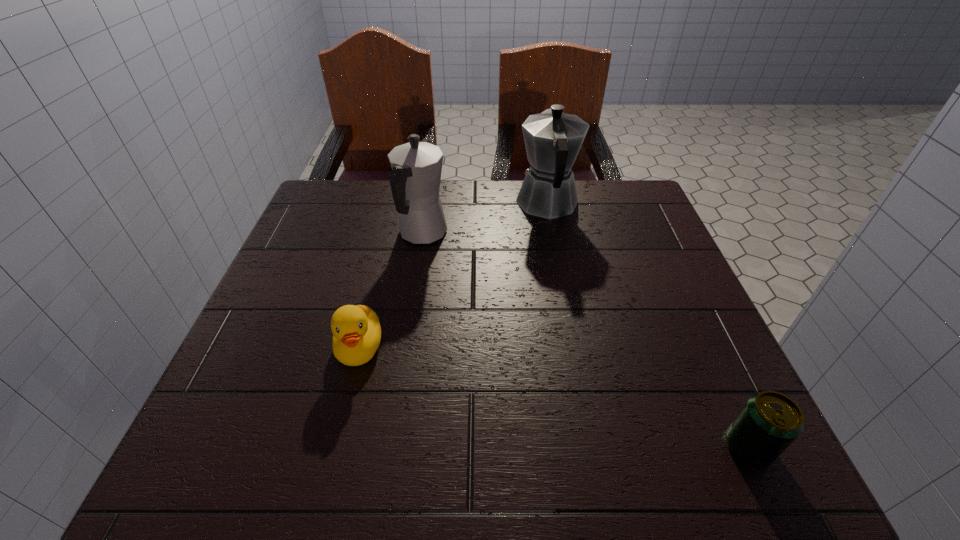
The width and height of the screenshot is (960, 540). Identify the location of object located at the near right corner. (769, 422).

What are the coordinates of `free space at the far edge of the desktop` in the screenshot? It's located at (504, 211).

In order to click on free location at the near edge in this screenshot , I will do `click(544, 440)`.

Locate an element on the screen. vacant space at the left edge of the desktop is located at coordinates (280, 386).

The height and width of the screenshot is (540, 960). In order to click on free space at the right edge of the desktop in this screenshot , I will do `click(656, 231)`.

Image resolution: width=960 pixels, height=540 pixels. Identify the location of vacant space at the far left corner of the desktop. (360, 198).

This screenshot has width=960, height=540. I want to click on vacant space at the near left corner, so click(293, 424).

Where is `vacant space at the far right corner of the desktop`? This screenshot has height=540, width=960. vacant space at the far right corner of the desktop is located at coordinates 635,205.

This screenshot has width=960, height=540. I want to click on vacant space that's between the left coffeepot and the beer can, so click(586, 340).

Locate an element on the screen. The height and width of the screenshot is (540, 960). empty location between the beer can and the duck is located at coordinates (554, 397).